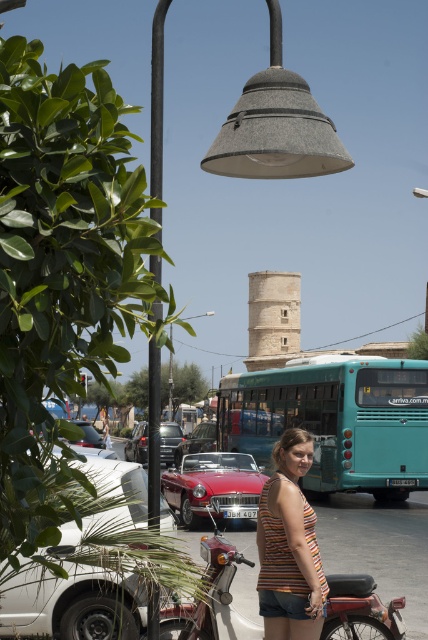
Does striped fabric tank top at center appear on the right side of shiny black sedan at center?

Indeed, striped fabric tank top at center is positioned on the right side of shiny black sedan at center.

Is striped fabric tank top at center thinner than shiny black sedan at center?

Indeed, striped fabric tank top at center has a lesser width compared to shiny black sedan at center.

Is point (276, 566) farther from viewer compared to point (166, 442)?

No, it is in front of (166, 442).

Where is `striped fabric tank top at center`? The image size is (428, 640). striped fabric tank top at center is located at coordinates coord(290,547).

Is metallic red motorcycle at center positioned at the back of light beige stone tower at center?

No, it is in front of light beige stone tower at center.

From the picture: Which is more to the left, metallic red motorcycle at center or light beige stone tower at center?

Positioned to the left is metallic red motorcycle at center.

This screenshot has width=428, height=640. In order to click on metallic red motorcycle at center in this screenshot , I will do `click(211, 596)`.

Describe the element at coordinates (335, 420) in the screenshot. This screenshot has width=428, height=640. I see `teal matte bus at center` at that location.

Looking at this image, which of these two, teal matte bus at center or shiny red car at center, stands shorter?

With less height is shiny red car at center.

Describe the element at coordinates (335, 420) in the screenshot. I see `teal matte bus at center` at that location.

In order to click on teal matte bus at center in this screenshot , I will do `click(335, 420)`.